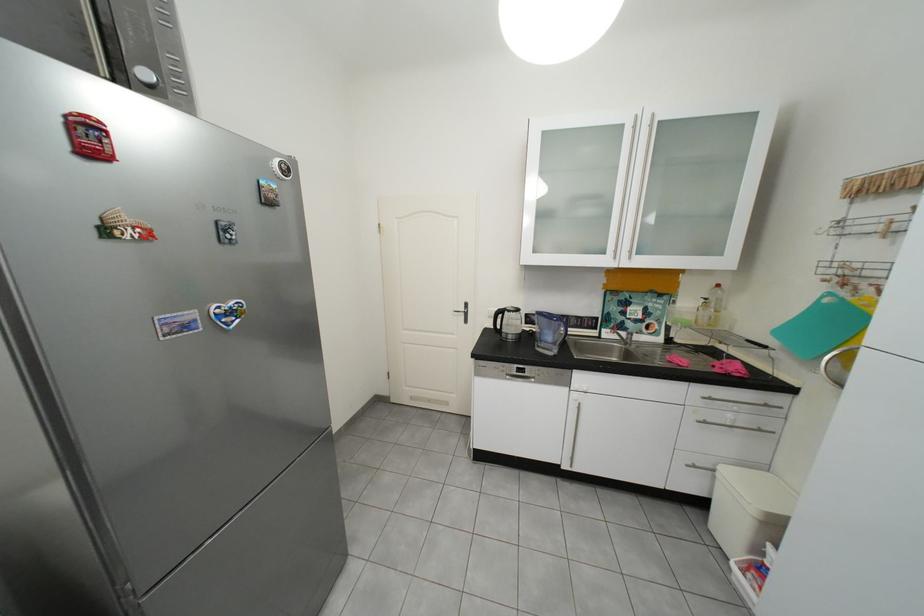
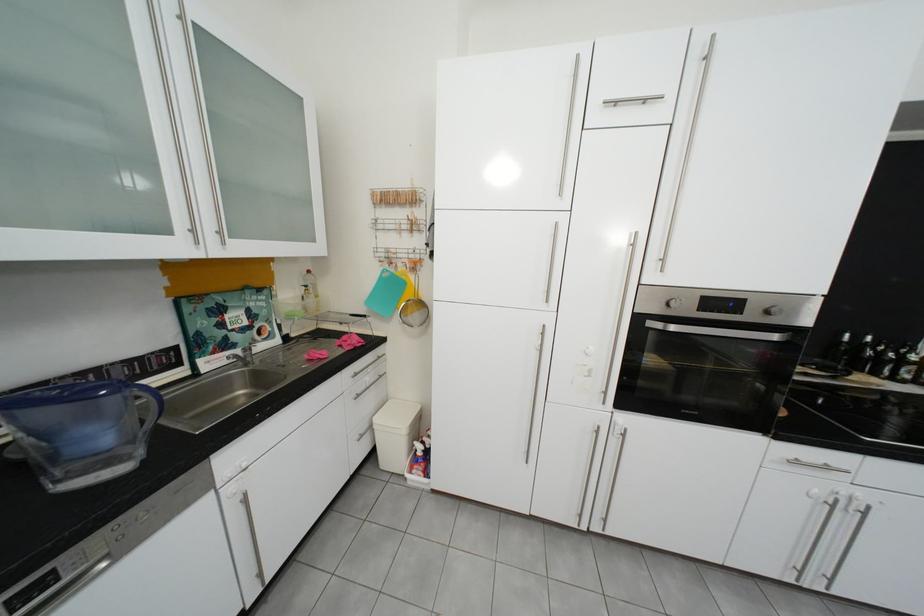
The point at (701,318) is marked in the first image. Where is the corresponding point in the second image?

(311, 310)